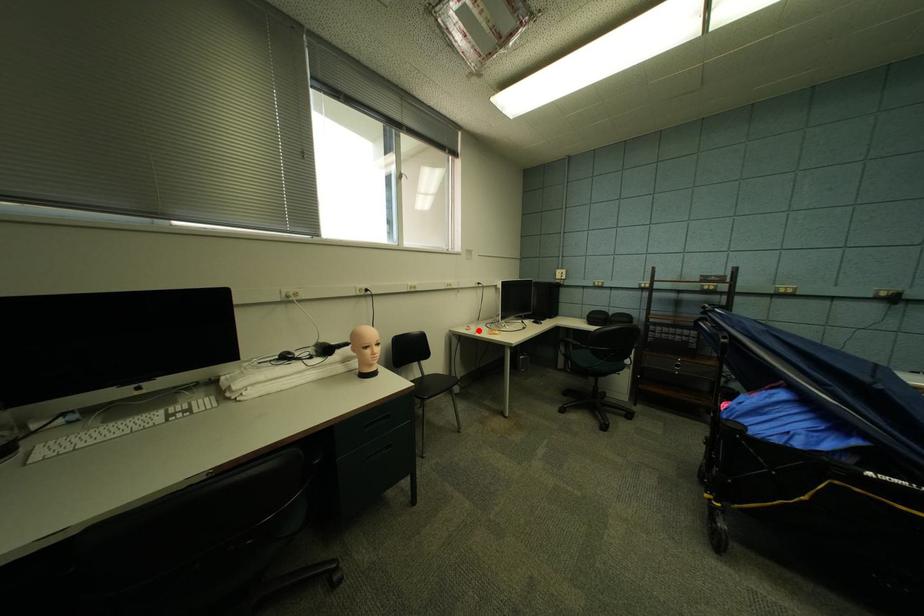
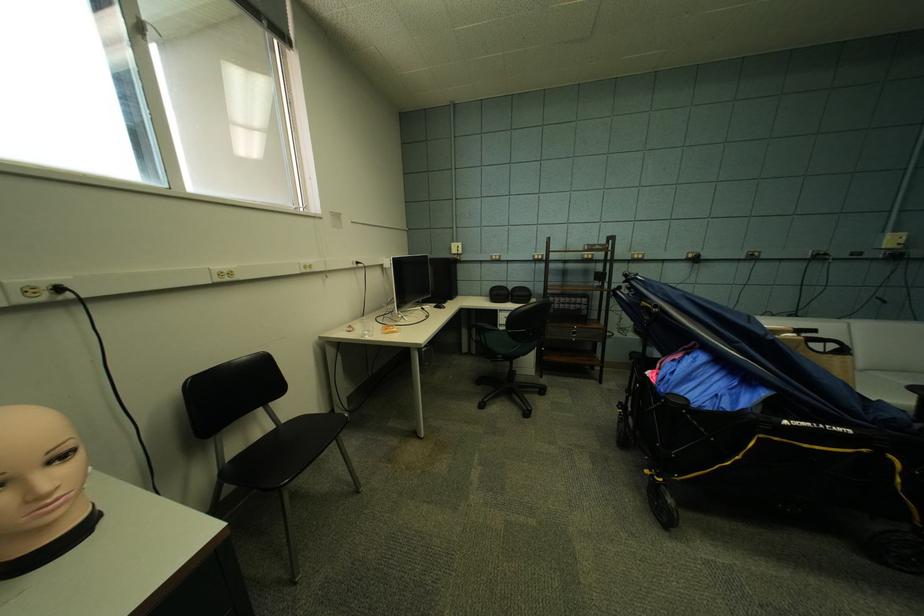
Question: I am providing you with two images of the same scene from different viewpoints. A red point is marked on the first image. Can you still see the location of the red point in image 2?

Choices:
 (A) Yes
 (B) No

Answer: (A)